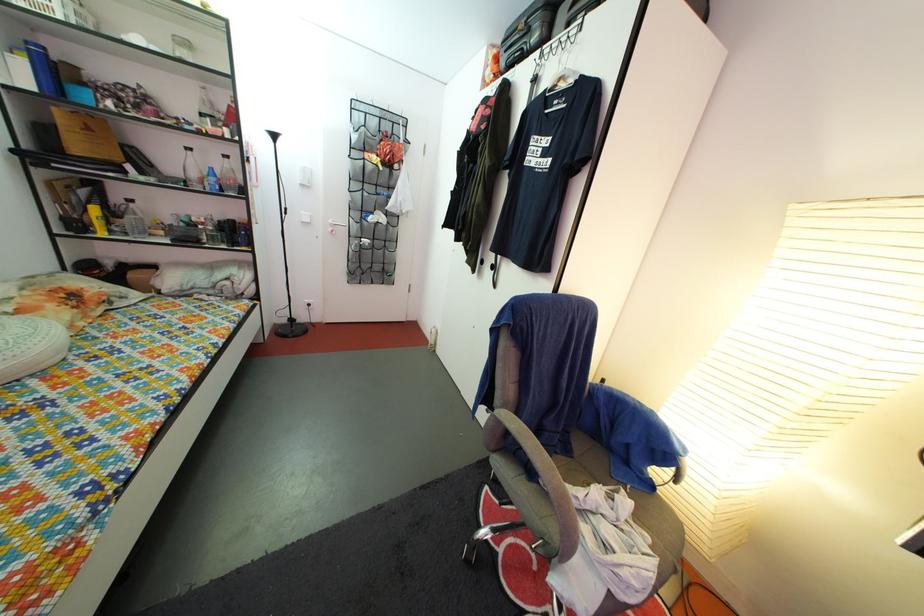
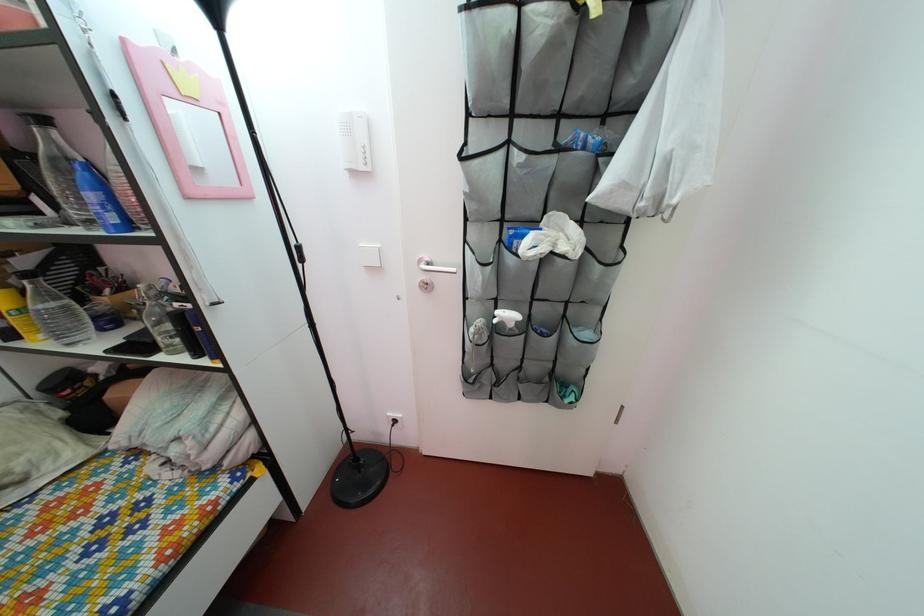
The point at (408, 208) is marked in the first image. Where is the corresponding point in the second image?

(675, 152)